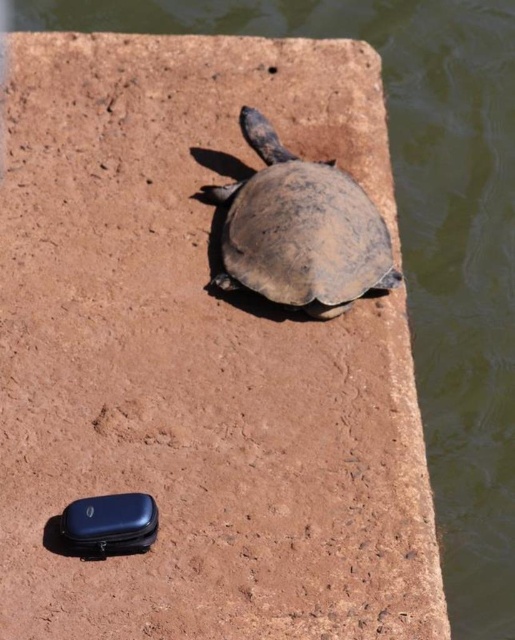
In the scene shown: What is located at the coordinates point (300, 230) in the image?

The coordinates point (300, 230) indicate the location of the brown matte tortoise at center.

You are standing at the origin point of the coordinate system. You see two points, point (341, 285) and point (145, 516). Which point is closer to you?

Point (145, 516) is closer to you because it is in front of point (341, 285).

You are a photographer trying to capture the brown matte tortoise at center and the matte black phone case at lower left in a single frame. Based on their positions, which object should you adjust your camera angle to focus on first to ensure both are in the shot?

Since the brown matte tortoise at center is to the right of the matte black phone case at lower left, you should first focus on the brown matte tortoise at center to ensure both objects remain within the frame.